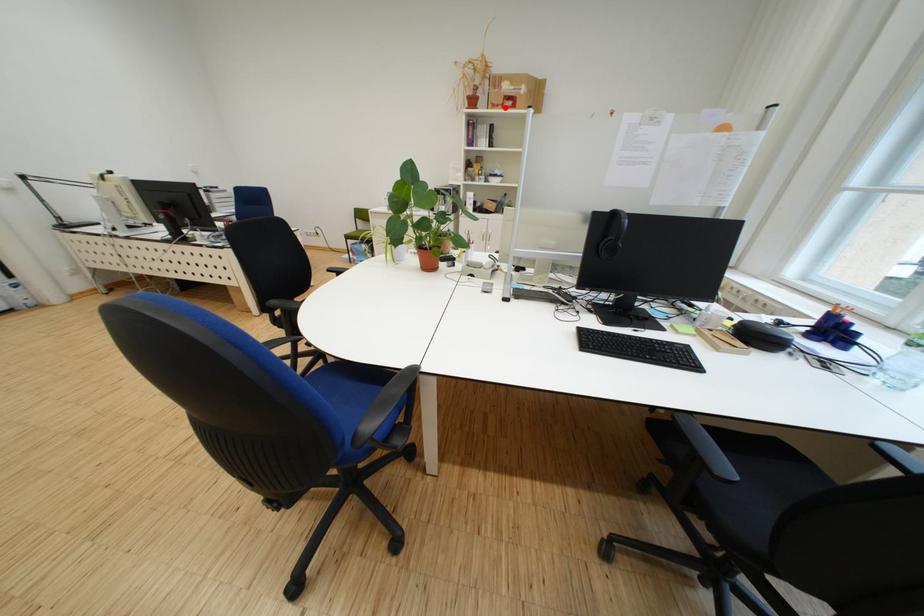
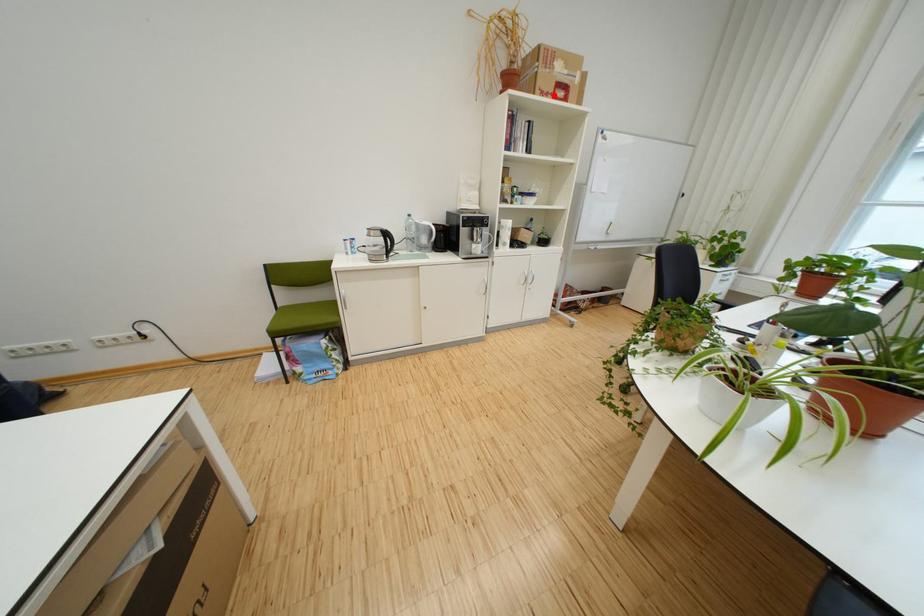
I am providing you with two images of the same scene from different viewpoints. A red point is marked on the first image and another point is marked on the second image. Is the red point in image1 aligned with the point shown in image2?

Yes